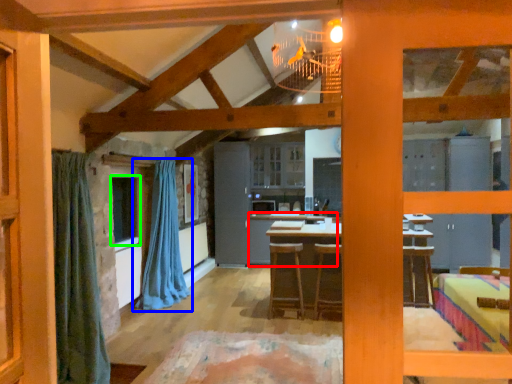
Question: Which object is the closest to the table (highlighted by a red box)? Choose among these: curtain (highlighted by a blue box) or window (highlighted by a green box).

Choices:
 (A) curtain
 (B) window

Answer: (A)